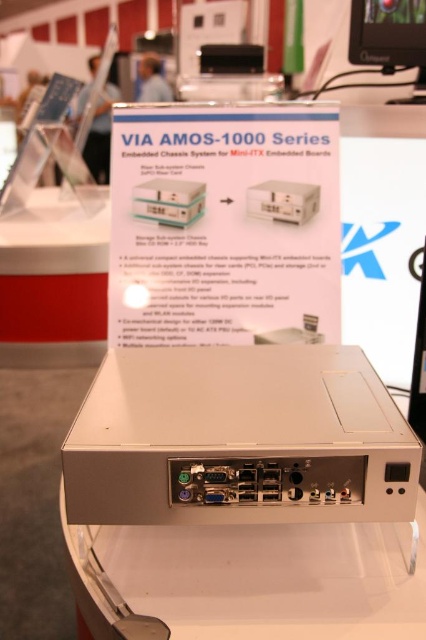
Question: Which point is farther from the camera taking this photo?

Choices:
 (A) (376, 552)
 (B) (356, 54)

Answer: (B)

Question: Which object is positioned farthest from the white plastic table at lower left?

Choices:
 (A) white plastic table at center
 (B) matte black monitor at upper right

Answer: (A)

Question: Is white plastic table at lower left positioned at the back of matte black monitor at upper right?

Choices:
 (A) yes
 (B) no

Answer: (A)

Question: Considering the relative positions of white plastic table at center and matte black monitor at upper right in the image provided, where is white plastic table at center located with respect to matte black monitor at upper right?

Choices:
 (A) right
 (B) left

Answer: (B)

Question: Considering the real-world distances, which object is closest to the white plastic table at lower left?

Choices:
 (A) white plastic table at center
 (B) matte black monitor at upper right

Answer: (B)

Question: Is the position of white plastic table at center less distant than that of white plastic table at lower left?

Choices:
 (A) no
 (B) yes

Answer: (B)